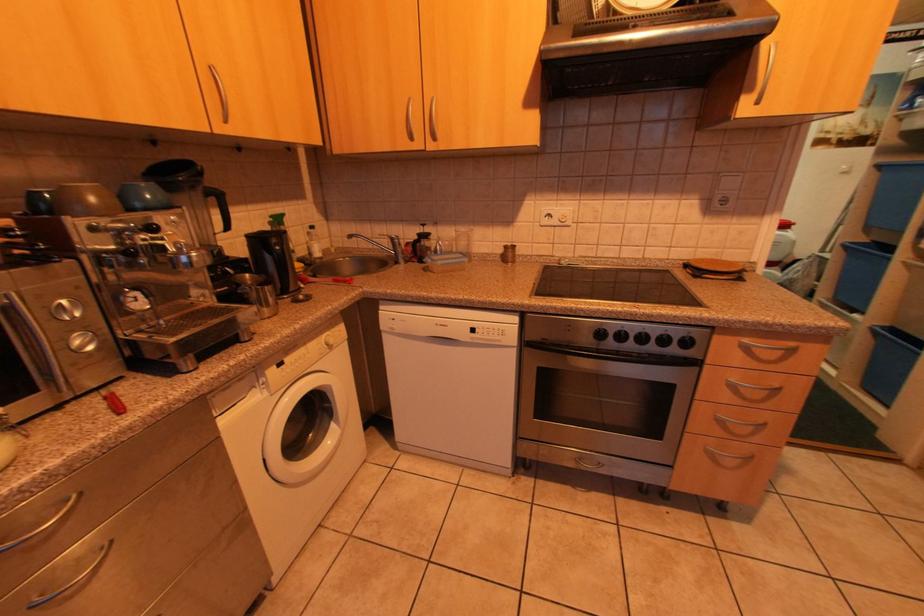
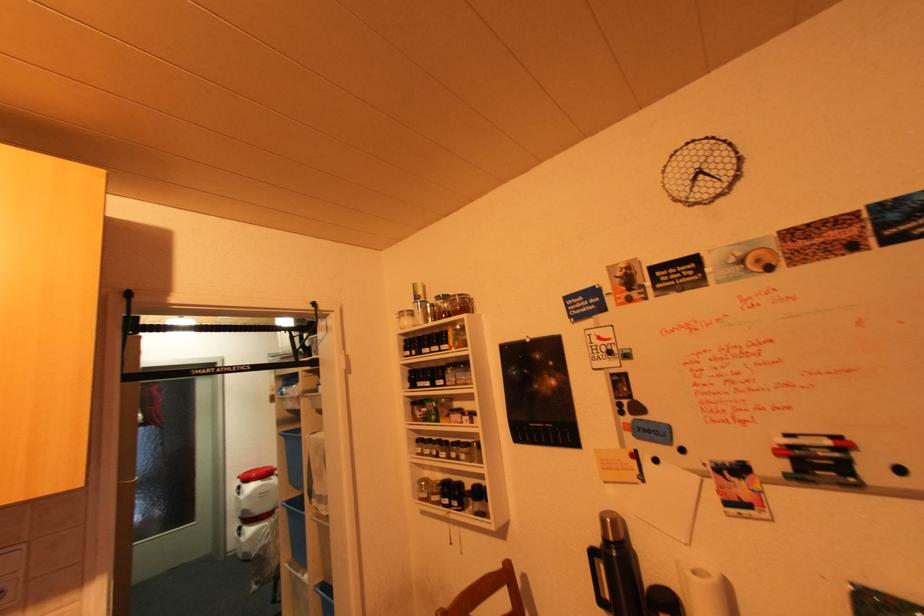
First-person continuous shooting, in which direction is the camera rotating?

The rotation direction of the camera is right-up.